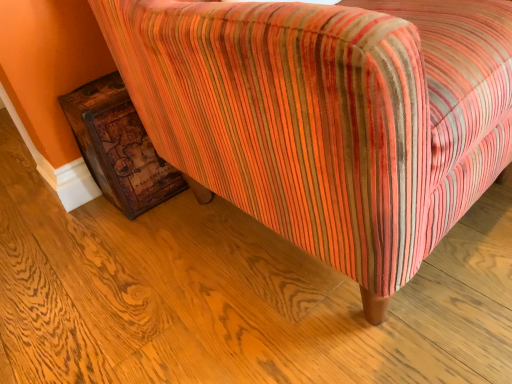
Question: Looking at their shapes, would you say distressed wood trunk at lower left is wider or thinner than striped fabric chair at lower right?

Choices:
 (A) thin
 (B) wide

Answer: (A)

Question: Relative to striped fabric chair at lower right, is distressed wood trunk at lower left in front or behind?

Choices:
 (A) behind
 (B) front

Answer: (A)

Question: Is point (128, 144) closer or farther from the camera than point (438, 59)?

Choices:
 (A) closer
 (B) farther

Answer: (B)

Question: From the image's perspective, relative to distressed wood trunk at lower left, is striped fabric chair at lower right above or below?

Choices:
 (A) above
 (B) below

Answer: (A)

Question: In the image, is striped fabric chair at lower right on the left side or the right side of distressed wood trunk at lower left?

Choices:
 (A) left
 (B) right

Answer: (B)

Question: In terms of width, does striped fabric chair at lower right look wider or thinner when compared to distressed wood trunk at lower left?

Choices:
 (A) thin
 (B) wide

Answer: (B)

Question: Considering their positions, is striped fabric chair at lower right located in front of or behind distressed wood trunk at lower left?

Choices:
 (A) behind
 (B) front

Answer: (B)